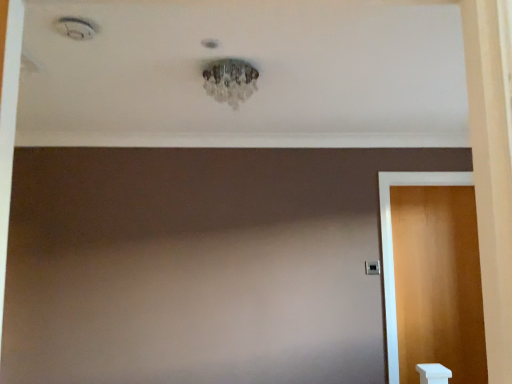
Question: Visually, is black plastic door handle at right positioned to the left or to the right of wooden door at right?

Choices:
 (A) right
 (B) left

Answer: (B)

Question: Considering the positions of point (368, 263) and point (391, 264), is point (368, 263) closer or farther from the camera than point (391, 264)?

Choices:
 (A) farther
 (B) closer

Answer: (B)

Question: From the image's perspective, is black plastic door handle at right above or below wooden door at right?

Choices:
 (A) above
 (B) below

Answer: (A)

Question: Based on their positions, is wooden door at right located to the left or right of black plastic door handle at right?

Choices:
 (A) left
 (B) right

Answer: (B)

Question: From the image's perspective, is wooden door at right above or below black plastic door handle at right?

Choices:
 (A) below
 (B) above

Answer: (A)

Question: In terms of width, does wooden door at right look wider or thinner when compared to black plastic door handle at right?

Choices:
 (A) wide
 (B) thin

Answer: (A)

Question: Is wooden door at right taller or shorter than black plastic door handle at right?

Choices:
 (A) tall
 (B) short

Answer: (A)